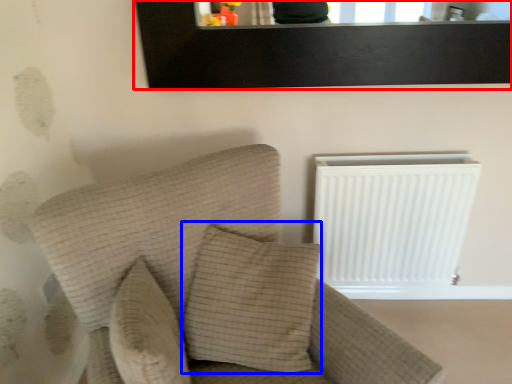
Question: Among these objects, which one is nearest to the camera, picture frame (highlighted by a red box) or pillow (highlighted by a blue box)?

Choices:
 (A) picture frame
 (B) pillow

Answer: (B)